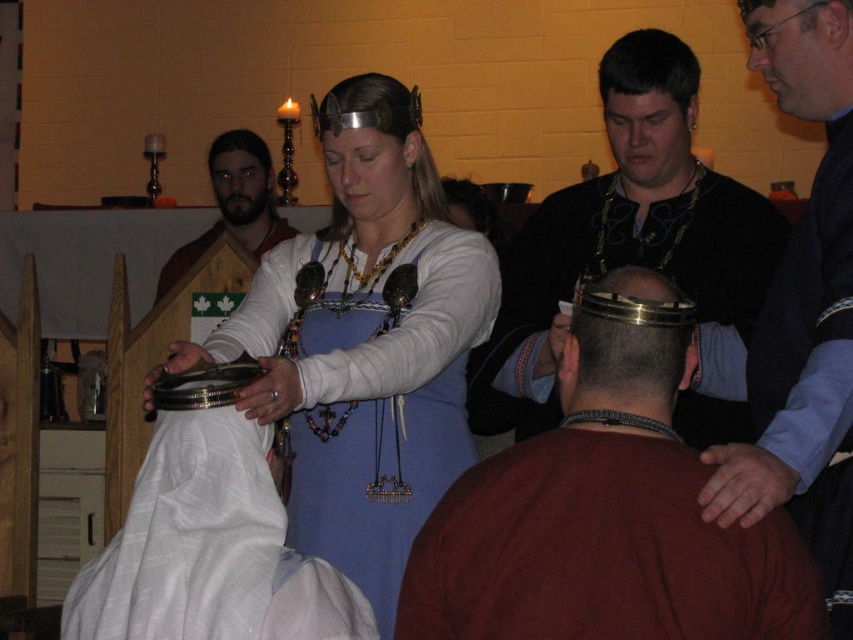
Question: Can you confirm if matte blue dress at center is positioned below blonde hair at center?

Choices:
 (A) yes
 (B) no

Answer: (A)

Question: Which point is farther to the camera?

Choices:
 (A) brown straight hair at center
 (B) metallic helmet at center
 (C) brown leather belt at center
 (D) gold metallic crown at center

Answer: (A)

Question: Which point is closer to the camera taking this photo?

Choices:
 (A) (668, 49)
 (B) (811, 248)
 (C) (258, 156)
 (D) (300, 465)

Answer: (B)

Question: Does matte black beard at upper left appear on the right side of blonde hair at center?

Choices:
 (A) no
 (B) yes

Answer: (A)

Question: Does matte black head at upper right appear on the left side of matte black beard at upper left?

Choices:
 (A) yes
 (B) no

Answer: (B)

Question: Which point is farther to the camera?

Choices:
 (A) bearded man with white shirt at center
 (B) blonde hair at center
 (C) metallic helmet at center

Answer: (A)